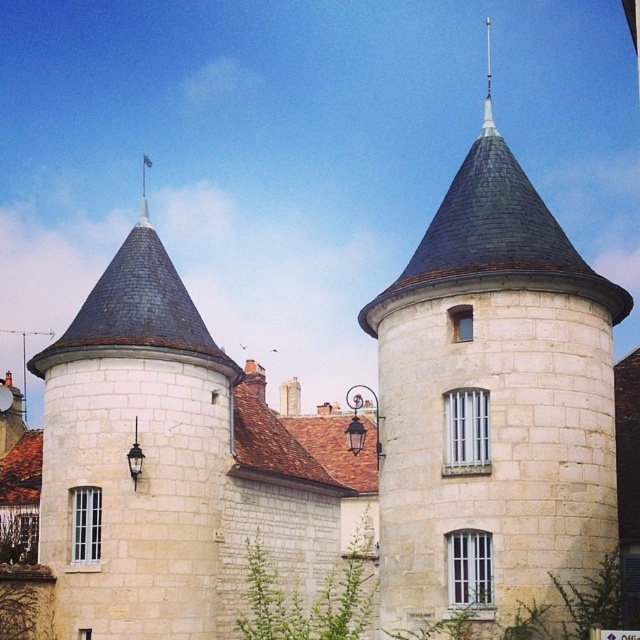
You are standing in front of two towers. The white stone tower at center and the smooth stone tower at left. Which tower is positioned higher up in the image?

The white stone tower at center is positioned higher up in the image than the smooth stone tower at left.